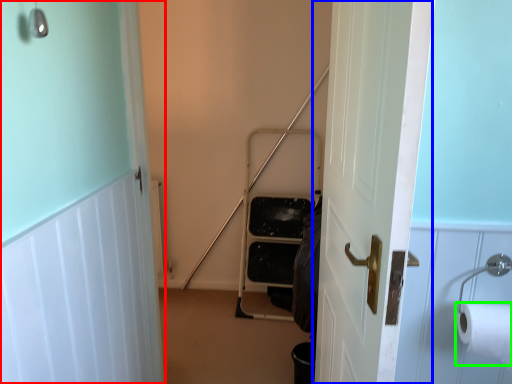
Question: Which object is positioned closest to door (highlighted by a red box)? Select from door (highlighted by a blue box) and toilet paper (highlighted by a green box).

Choices:
 (A) door
 (B) toilet paper

Answer: (A)